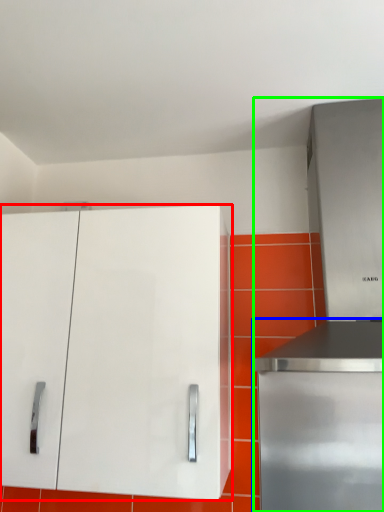
Question: Which object is positioned closest to cabinetry (highlighted by a red box)? Select from home appliance (highlighted by a blue box) and appliance (highlighted by a green box).

Choices:
 (A) home appliance
 (B) appliance

Answer: (B)